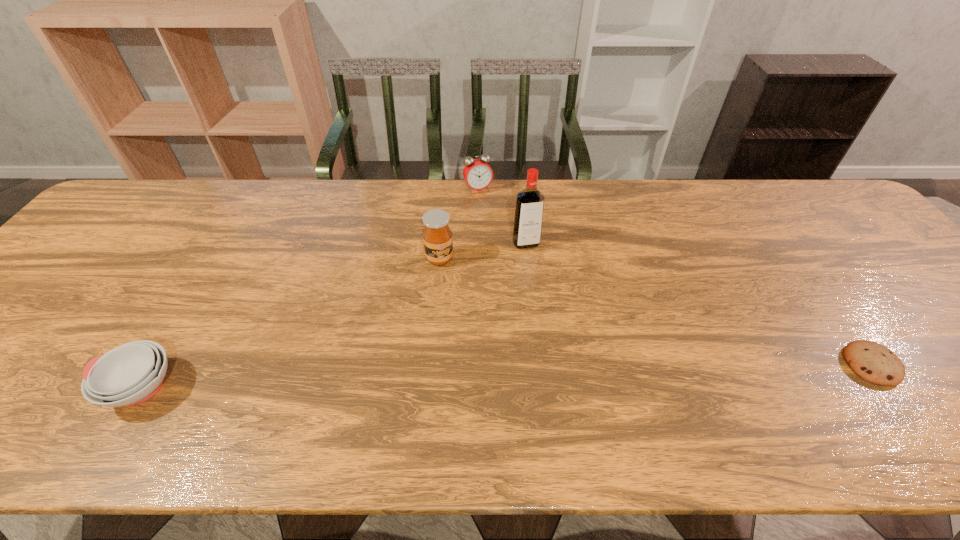
At what (x,y) coordinates should I click in order to perform the action: click on vacant space situated 0.200m on the front-facing side of the fourth object from right to left. Please return your answer as a coordinate pair (x, y). Image resolution: width=960 pixels, height=540 pixels. Looking at the image, I should click on (478, 321).

The image size is (960, 540). Find the location of `object located in the far edge section of the desktop`. object located in the far edge section of the desktop is located at coordinates (478, 175).

Find the location of a particular element. Image resolution: width=960 pixels, height=540 pixels. soup bowl situated at the near edge is located at coordinates (132, 373).

Image resolution: width=960 pixels, height=540 pixels. What are the coordinates of `cookie at the near edge` in the screenshot? It's located at 871,361.

Identify the location of vacant area at the far edge of the desktop. (327, 202).

In the image, there is a desktop. At what (x,y) coordinates should I click in order to perform the action: click on vacant region at the near edge. Please return your answer as a coordinate pair (x, y). This screenshot has height=540, width=960. Looking at the image, I should click on (564, 374).

Locate an element on the screen. The height and width of the screenshot is (540, 960). vacant space at the right edge of the desktop is located at coordinates (948, 362).

Find the location of a particular element. The image size is (960, 540). free space at the far right corner of the desktop is located at coordinates (834, 214).

Find the location of a particular element. This screenshot has width=960, height=540. free area in between the fourth tallest object and the cookie is located at coordinates (506, 376).

This screenshot has height=540, width=960. In order to click on unoccupied area between the tallest object and the rightmost object in this screenshot , I will do `click(699, 304)`.